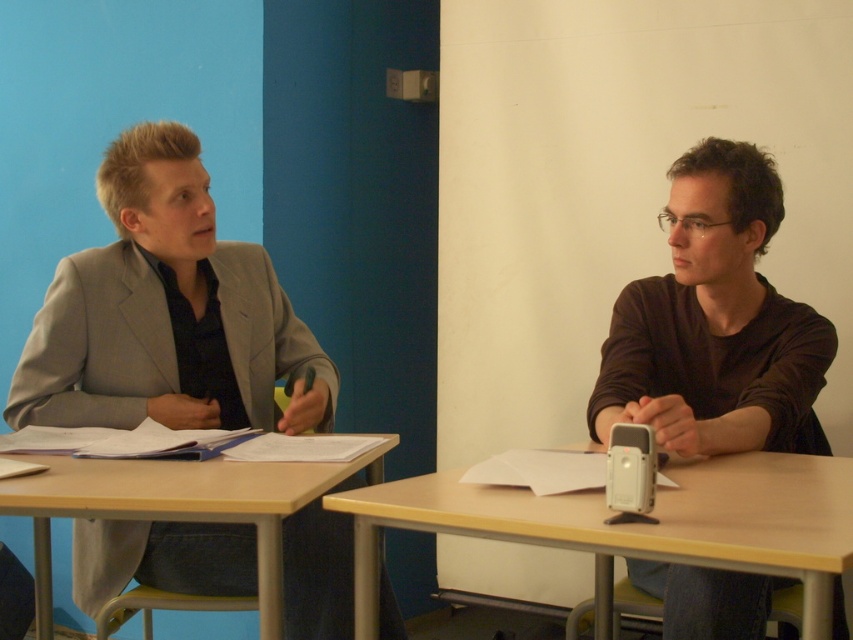
Is matte gray blazer at left thinner than matte brown shirt at right?

In fact, matte gray blazer at left might be wider than matte brown shirt at right.

Looking at this image, which is more to the left, matte gray blazer at left or matte brown shirt at right?

matte gray blazer at left

I want to click on matte gray blazer at left, so click(167, 314).

Find the location of `matte gray blazer at left`. matte gray blazer at left is located at coordinates (167, 314).

Which is below, matte gray blazer at left or light brown wood table at lower left?

light brown wood table at lower left is lower down.

Is point (259, 353) closer to camera compared to point (86, 488)?

That is False.

You are a GUI agent. You are given a task and a screenshot of the screen. Output one action in this format:
    pyautogui.click(x=<x>, y=<y>)
    Task: Click on the matte gray blazer at left
    The width and height of the screenshot is (853, 640).
    Given the screenshot: What is the action you would take?
    pyautogui.click(x=167, y=314)

Which is behind, point (221, 269) or point (521, 524)?

Point (221, 269)

Is matte gray blazer at left wider than light wood table at center?

No, matte gray blazer at left is not wider than light wood table at center.

Which is in front, point (131, 524) or point (680, 490)?

Point (680, 490) is more forward.

Image resolution: width=853 pixels, height=640 pixels. I want to click on matte gray blazer at left, so click(167, 314).